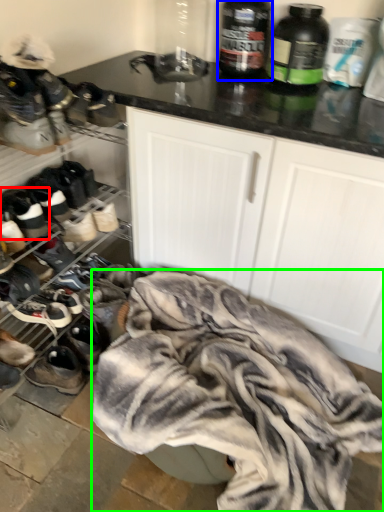
Question: Which is nearer to the footwear (highlighted by a red box)? bottle (highlighted by a blue box) or clothing (highlighted by a green box).

Choices:
 (A) bottle
 (B) clothing

Answer: (B)